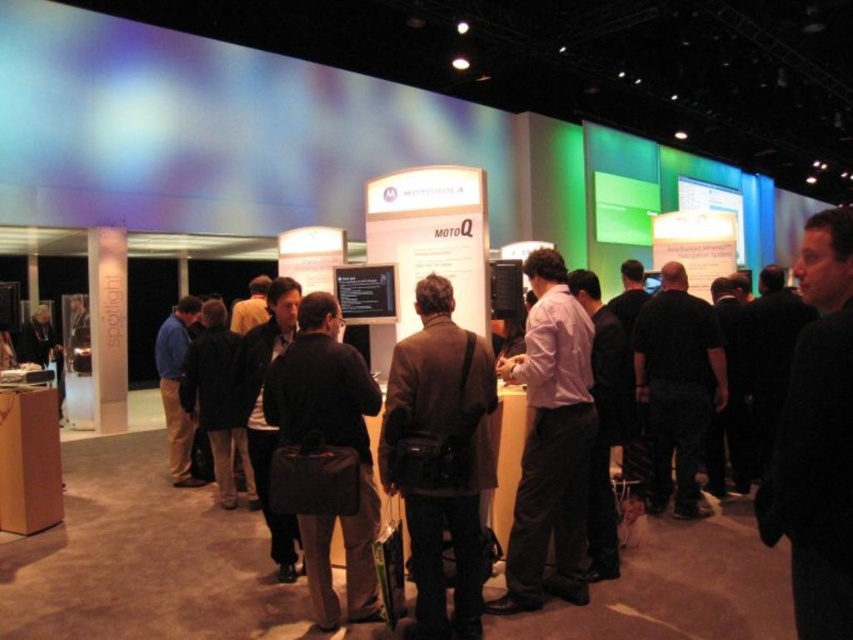
Locate an element on the screen. Image resolution: width=853 pixels, height=640 pixels. brown leather jacket at center is located at coordinates (x=453, y=456).

Is point (485, 396) less distant than point (537, 486)?

Yes, it is.

This screenshot has height=640, width=853. What do you see at coordinates (453, 456) in the screenshot? I see `brown leather jacket at center` at bounding box center [453, 456].

In order to click on brown leather jacket at center in this screenshot , I will do `click(453, 456)`.

Is point (451, 419) farther from viewer compared to point (316, 477)?

No, it is in front of (316, 477).

How far apart are brown leather jacket at center and dark brown leather jacket at center?

brown leather jacket at center is 33.73 centimeters away from dark brown leather jacket at center.

Is point (428, 532) closer to viewer compared to point (314, 596)?

Yes, point (428, 532) is in front of point (314, 596).

Identify the location of brown leather jacket at center. This screenshot has width=853, height=640. (453, 456).

Who is positioned more to the left, dark brown leather jacket at center or purple cotton shirt at center?

dark brown leather jacket at center

The height and width of the screenshot is (640, 853). What are the coordinates of `dark brown leather jacket at center` in the screenshot? It's located at (325, 456).

You are a GUI agent. You are given a task and a screenshot of the screen. Output one action in this format:
    pyautogui.click(x=<x>, y=<y>)
    Task: Click on the dark brown leather jacket at center
    This screenshot has width=853, height=640.
    Given the screenshot: What is the action you would take?
    pyautogui.click(x=325, y=456)